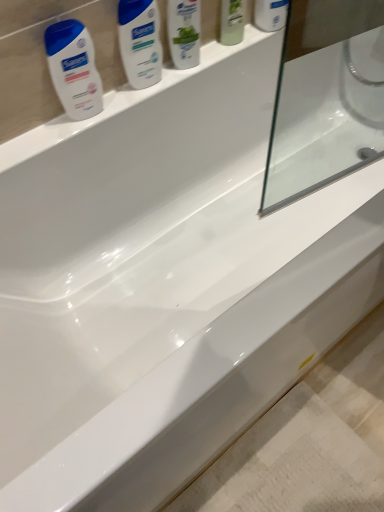
Describe the element at coordinates (232, 21) in the screenshot. The width and height of the screenshot is (384, 512). I see `green matte mouthwash at upper center, placed as the 1th mouthwash when sorted from left to right` at that location.

Where is `white glossy mouthwash at upper center, the second mouthwash in the left-to-right sequence`? white glossy mouthwash at upper center, the second mouthwash in the left-to-right sequence is located at coordinates (270, 14).

Does point (241, 36) come behind point (144, 10)?

Yes, it is.

Is green matte mouthwash at upper center, the 2th mouthwash in the right-to-left sequence, shorter than white glossy lotion at upper left?

Incorrect, the height of green matte mouthwash at upper center, the 2th mouthwash in the right-to-left sequence, does not fall short of that of white glossy lotion at upper left.

From a real-world perspective, is green matte mouthwash at upper center, the 2th mouthwash in the right-to-left sequence, positioned over white glossy lotion at upper left based on gravity?

Correct, in the physical world, green matte mouthwash at upper center, the 2th mouthwash in the right-to-left sequence, is higher than white glossy lotion at upper left.

How many degrees apart are the facing directions of green matte mouthwash at upper center, the 2th mouthwash in the right-to-left sequence, and white glossy lotion at upper left?

They differ by 0.00273 degrees in their facing directions.

Between white glossy mouthwash at upper center, the second mouthwash in the left-to-right sequence, and green matte mouthwash at upper center, the 2th mouthwash in the right-to-left sequence, which one has larger width?

white glossy mouthwash at upper center, the second mouthwash in the left-to-right sequence.

Is white glossy mouthwash at upper center, the second mouthwash in the left-to-right sequence, bigger than green matte mouthwash at upper center, the 2th mouthwash in the right-to-left sequence?

Yes, white glossy mouthwash at upper center, the second mouthwash in the left-to-right sequence, is bigger than green matte mouthwash at upper center, the 2th mouthwash in the right-to-left sequence.

Is white glossy mouthwash at upper center, the second mouthwash in the left-to-right sequence, facing away from green matte mouthwash at upper center, the 2th mouthwash in the right-to-left sequence?

That's not correct — white glossy mouthwash at upper center, the second mouthwash in the left-to-right sequence, is not looking away from green matte mouthwash at upper center, the 2th mouthwash in the right-to-left sequence.

Would you say white glossy shampoo at upper center, which ranks as the 1th cleaning product in right-to-left order, is outside white glossy lotion at upper left, the first cleaning product from the bottom?

That's correct, white glossy shampoo at upper center, which ranks as the 1th cleaning product in right-to-left order, is outside of white glossy lotion at upper left, the first cleaning product from the bottom.

From a real-world perspective, who is located higher, white glossy shampoo at upper center, which ranks as the 1th cleaning product in right-to-left order, or white glossy lotion at upper left, the first cleaning product viewed from the left?

white glossy shampoo at upper center, which ranks as the 1th cleaning product in right-to-left order, from a real-world perspective.

Is the surface of white glossy shampoo at upper center, which is the second cleaning product from left to right, in direct contact with white glossy lotion at upper left, the first cleaning product from the bottom?

No, white glossy shampoo at upper center, which is the second cleaning product from left to right, is not in contact with white glossy lotion at upper left, the first cleaning product from the bottom.

In the scene shown: Considering the relative sizes of white glossy lotion at upper left and white glossy lotion at upper left, which ranks as the 2th cleaning product in top-to-bottom order, in the image provided, is white glossy lotion at upper left shorter than white glossy lotion at upper left, which ranks as the 2th cleaning product in top-to-bottom order,?

Correct, white glossy lotion at upper left is not as tall as white glossy lotion at upper left, which ranks as the 2th cleaning product in top-to-bottom order.

Does point (125, 17) come closer to viewer compared to point (65, 21)?

No, it is not.

Is white glossy lotion at upper left next to white glossy lotion at upper left, which ranks as the 2th cleaning product in top-to-bottom order, and touching it?

No, white glossy lotion at upper left is not with white glossy lotion at upper left, which ranks as the 2th cleaning product in top-to-bottom order.

From the picture: From a real-world perspective, relative to white glossy lotion at upper left, the first cleaning product from the bottom, is white glossy lotion at upper left vertically above or below?

In terms of real-world spatial position, white glossy lotion at upper left is above white glossy lotion at upper left, the first cleaning product from the bottom.

Which is in front, white glossy shampoo at upper center, placed as the 2th cleaning product when sorted from bottom to top, or white glossy lotion at upper left?

white glossy lotion at upper left is in front.

From the image's perspective, is white glossy shampoo at upper center, which is the second cleaning product from left to right, above white glossy lotion at upper left?

Yes, from the image's perspective, white glossy shampoo at upper center, which is the second cleaning product from left to right, is on top of white glossy lotion at upper left.

In the image, is white glossy shampoo at upper center, placed as the 2th cleaning product when sorted from bottom to top, on the left side or the right side of white glossy lotion at upper left?

In the image, white glossy shampoo at upper center, placed as the 2th cleaning product when sorted from bottom to top, appears on the right side of white glossy lotion at upper left.

Is white glossy lotion at upper left, the first cleaning product viewed from the left, directly adjacent to white glossy shampoo at upper center, which ranks as the 1th cleaning product in right-to-left order?

There is a gap between white glossy lotion at upper left, the first cleaning product viewed from the left, and white glossy shampoo at upper center, which ranks as the 1th cleaning product in right-to-left order.

Do you think white glossy lotion at upper left, marked as the 2th cleaning product in a right-to-left arrangement, is within white glossy shampoo at upper center, placed as the 2th cleaning product when sorted from bottom to top, or outside of it?

white glossy lotion at upper left, marked as the 2th cleaning product in a right-to-left arrangement, is not inside white glossy shampoo at upper center, placed as the 2th cleaning product when sorted from bottom to top, it's outside.

Between white glossy lotion at upper left, the first cleaning product viewed from the left, and white glossy shampoo at upper center, which is the second cleaning product from left to right, which one appears on the right side from the viewer's perspective?

From the viewer's perspective, white glossy shampoo at upper center, which is the second cleaning product from left to right, appears more on the right side.

Is white glossy lotion at upper left, marked as the 2th cleaning product in a right-to-left arrangement, oriented towards white glossy shampoo at upper center, placed as the 2th cleaning product when sorted from bottom to top?

No, white glossy lotion at upper left, marked as the 2th cleaning product in a right-to-left arrangement, does not turn towards white glossy shampoo at upper center, placed as the 2th cleaning product when sorted from bottom to top.

Does white glossy lotion at upper left, the first cleaning product viewed from the left, have a lesser height compared to green matte mouthwash at upper center, the 2th mouthwash in the right-to-left sequence?

Yes, white glossy lotion at upper left, the first cleaning product viewed from the left, is shorter than green matte mouthwash at upper center, the 2th mouthwash in the right-to-left sequence.

From a real-world perspective, is white glossy lotion at upper left, which ranks as the 2th cleaning product in top-to-bottom order, on top of green matte mouthwash at upper center, placed as the 1th mouthwash when sorted from left to right?

No, from a real-world perspective, white glossy lotion at upper left, which ranks as the 2th cleaning product in top-to-bottom order, is not on top of green matte mouthwash at upper center, placed as the 1th mouthwash when sorted from left to right.

Is white glossy lotion at upper left, which ranks as the 2th cleaning product in top-to-bottom order, facing towards green matte mouthwash at upper center, placed as the 1th mouthwash when sorted from left to right?

No.

Identify the location of the 1st mouthwash to the right of the white glossy lotion at upper left, counting from the anchor's position. This screenshot has height=512, width=384. (232, 21).

Where is `mouthwash on the left of white glossy mouthwash at upper center, which is counted as the 1th mouthwash, starting from the right`? The height and width of the screenshot is (512, 384). mouthwash on the left of white glossy mouthwash at upper center, which is counted as the 1th mouthwash, starting from the right is located at coordinates (232, 21).

In the scene shown: From the image, which object appears to be farther from white glossy shampoo at upper center, which is the second cleaning product from left to right, white glossy lotion at upper left or green matte mouthwash at upper center, placed as the 1th mouthwash when sorted from left to right?

Among the two, green matte mouthwash at upper center, placed as the 1th mouthwash when sorted from left to right, is located further to white glossy shampoo at upper center, which is the second cleaning product from left to right.

Estimate the real-world distances between objects in this image. Which object is closer to white glossy shampoo at upper center, which is the second cleaning product from left to right, green matte mouthwash at upper center, the 2th mouthwash in the right-to-left sequence, or white glossy lotion at upper left, marked as the 2th cleaning product in a right-to-left arrangement?

green matte mouthwash at upper center, the 2th mouthwash in the right-to-left sequence.

Which object lies nearer to the anchor point green matte mouthwash at upper center, the 2th mouthwash in the right-to-left sequence, white glossy mouthwash at upper center, the second mouthwash in the left-to-right sequence, or white glossy lotion at upper left?

Based on the image, white glossy mouthwash at upper center, the second mouthwash in the left-to-right sequence, appears to be nearer to green matte mouthwash at upper center, the 2th mouthwash in the right-to-left sequence.

Looking at the image, which one is located closer to white glossy lotion at upper left, white glossy shampoo at upper center, which is the second cleaning product from left to right, or white glossy lotion at upper left, marked as the 2th cleaning product in a right-to-left arrangement?

Among the two, white glossy shampoo at upper center, which is the second cleaning product from left to right, is located nearer to white glossy lotion at upper left.

Estimate the real-world distances between objects in this image. Which object is further from white glossy mouthwash at upper center, the second mouthwash in the left-to-right sequence, green matte mouthwash at upper center, the 2th mouthwash in the right-to-left sequence, or white glossy shampoo at upper center, which is the second cleaning product from left to right?

white glossy shampoo at upper center, which is the second cleaning product from left to right.

From the image, which object appears to be nearer to green matte mouthwash at upper center, placed as the 1th mouthwash when sorted from left to right, white glossy lotion at upper left or white glossy mouthwash at upper center, which is counted as the 1th mouthwash, starting from the right?

white glossy mouthwash at upper center, which is counted as the 1th mouthwash, starting from the right, is closer to green matte mouthwash at upper center, placed as the 1th mouthwash when sorted from left to right.

When comparing their distances from green matte mouthwash at upper center, the 2th mouthwash in the right-to-left sequence, does white glossy lotion at upper left, which ranks as the 2th cleaning product in top-to-bottom order, or white glossy mouthwash at upper center, which is counted as the 1th mouthwash, starting from the right, seem closer?

The object closer to green matte mouthwash at upper center, the 2th mouthwash in the right-to-left sequence, is white glossy mouthwash at upper center, which is counted as the 1th mouthwash, starting from the right.

When comparing their distances from white glossy mouthwash at upper center, the second mouthwash in the left-to-right sequence, does green matte mouthwash at upper center, placed as the 1th mouthwash when sorted from left to right, or white glossy lotion at upper left, marked as the 2th cleaning product in a right-to-left arrangement, seem closer?

The object closer to white glossy mouthwash at upper center, the second mouthwash in the left-to-right sequence, is green matte mouthwash at upper center, placed as the 1th mouthwash when sorted from left to right.

Locate an element on the screen. mouthwash between white glossy shampoo at upper center, which ranks as the 1th cleaning product in right-to-left order, and white glossy mouthwash at upper center, the second mouthwash in the left-to-right sequence, in the horizontal direction is located at coordinates point(232,21).

At what (x,y) coordinates should I click in order to perform the action: click on mouthwash located between white glossy lotion at upper left and white glossy mouthwash at upper center, the second mouthwash in the left-to-right sequence, in the left-right direction. Please return your answer as a coordinate pair (x, y). Looking at the image, I should click on (232, 21).

This screenshot has height=512, width=384. In order to click on personal care between white glossy lotion at upper left, marked as the 2th cleaning product in a right-to-left arrangement, and white glossy shampoo at upper center, placed as the 2th cleaning product when sorted from bottom to top in this screenshot , I will do `click(140, 41)`.

You are a GUI agent. You are given a task and a screenshot of the screen. Output one action in this format:
    pyautogui.click(x=<x>, y=<y>)
    Task: Click on the cleaning product between white glossy lotion at upper left and white glossy mouthwash at upper center, the second mouthwash in the left-to-right sequence
    
    Given the screenshot: What is the action you would take?
    pyautogui.click(x=184, y=32)